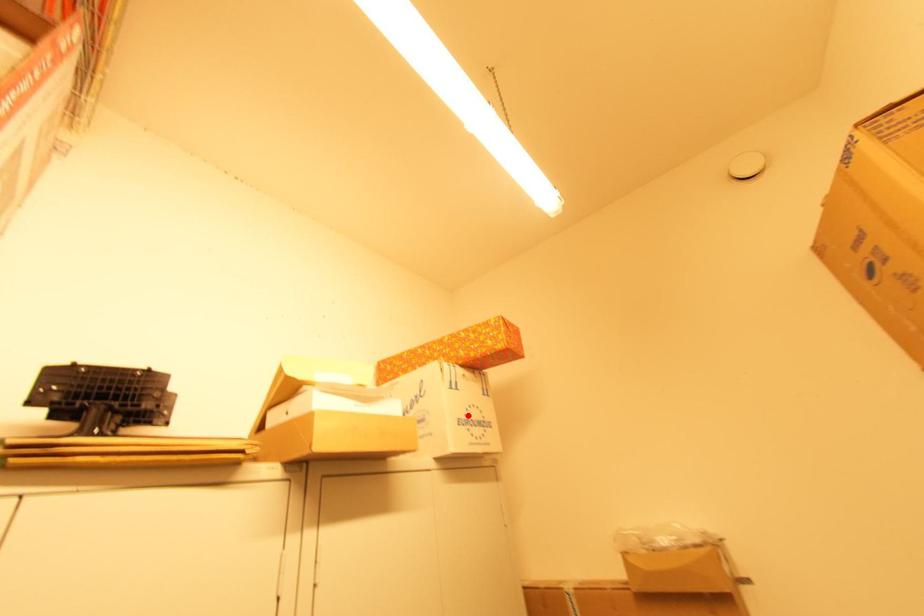
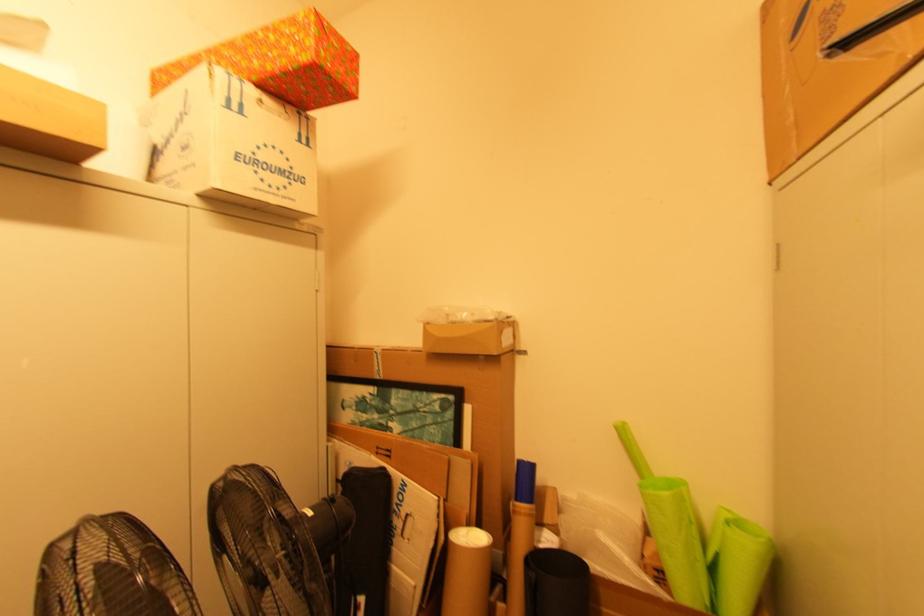
Find the pixel in the second image that matches the highlighted location in the first image.

(257, 154)